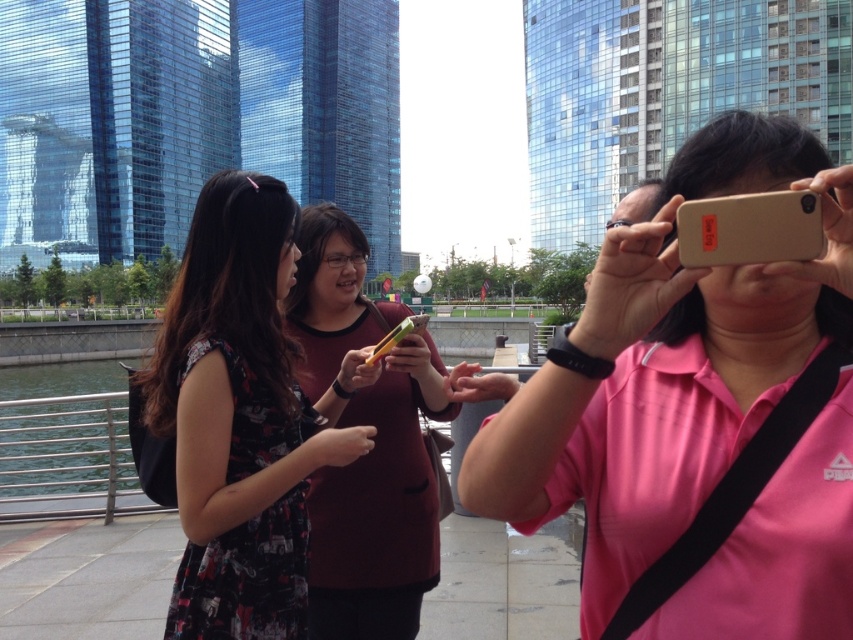
Is matte gold phone at center thinner than maroon fabric shirt at center?

No, matte gold phone at center is not thinner than maroon fabric shirt at center.

Is point (793, 128) more distant than point (425, 349)?

No, it is in front of (425, 349).

Where is `matte gold phone at center`? The width and height of the screenshot is (853, 640). matte gold phone at center is located at coordinates (666, 364).

Does matte gold phone at center appear under floral dress at center?

Actually, matte gold phone at center is above floral dress at center.

Describe the element at coordinates (666, 364) in the screenshot. The image size is (853, 640). I see `matte gold phone at center` at that location.

Find the location of a particular element. This screenshot has height=640, width=853. matte gold phone at center is located at coordinates (666, 364).

Does floral dress at center appear on the left side of maroon fabric shirt at center?

Indeed, floral dress at center is positioned on the left side of maroon fabric shirt at center.

Who is higher up, floral dress at center or maroon fabric shirt at center?

maroon fabric shirt at center is higher up.

Where is `floral dress at center`? Image resolution: width=853 pixels, height=640 pixels. floral dress at center is located at coordinates (239, 419).